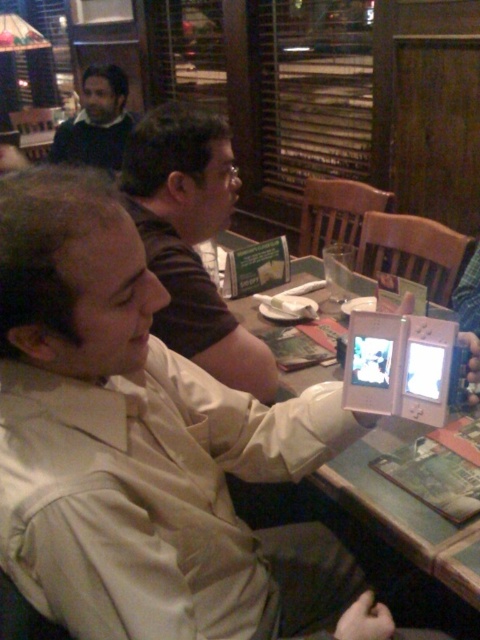
Question: Does beige fabric shirt at center have a greater width compared to matte black shirt at upper center?

Choices:
 (A) no
 (B) yes

Answer: (B)

Question: Does beige fabric shirt at center have a smaller size compared to dark blue sweater at upper left?

Choices:
 (A) yes
 (B) no

Answer: (B)

Question: Which of the following is the farthest from the observer?

Choices:
 (A) (123, 138)
 (B) (468, 618)

Answer: (A)

Question: Which of these objects is positioned closest to the beige fabric shirt at center?

Choices:
 (A) wooden table at center
 (B) silver metallic tablet at center
 (C) matte black shirt at upper center

Answer: (B)

Question: Is matte black shirt at upper center in front of wooden table at center?

Choices:
 (A) no
 (B) yes

Answer: (A)

Question: Which of the following is the closest to the observer?

Choices:
 (A) (303, 461)
 (B) (456, 634)
 (C) (111, 67)
 (D) (124, 188)

Answer: (A)